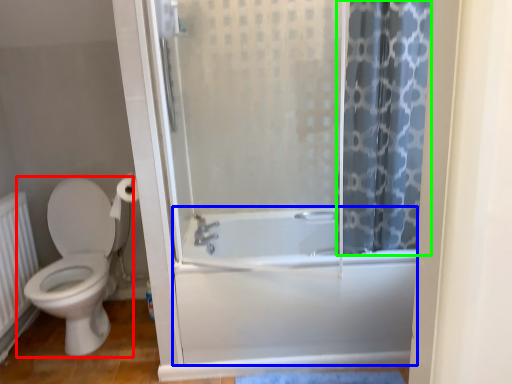
Question: Which object is positioned farthest from toilet (highlighted by a red box)? Select from bath (highlighted by a blue box) and shower curtain (highlighted by a green box).

Choices:
 (A) bath
 (B) shower curtain

Answer: (B)